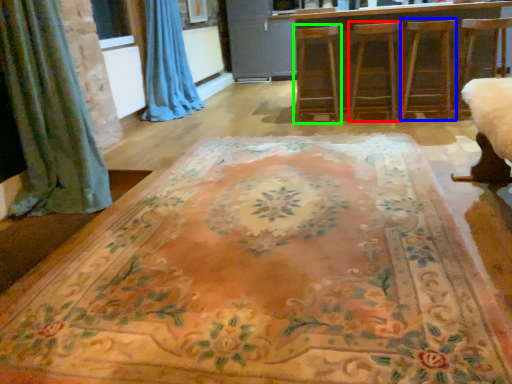
Question: Estimate the real-world distances between objects in this image. Which object is closer to armchair (highlighted by a red box), armchair (highlighted by a blue box) or armchair (highlighted by a green box)?

Choices:
 (A) armchair
 (B) armchair

Answer: (A)